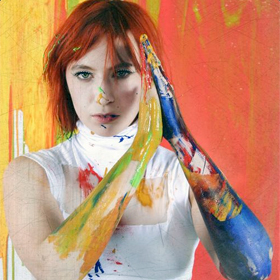
This screenshot has height=280, width=280. In order to click on yellow paint in this screenshot , I will do `click(32, 68)`.